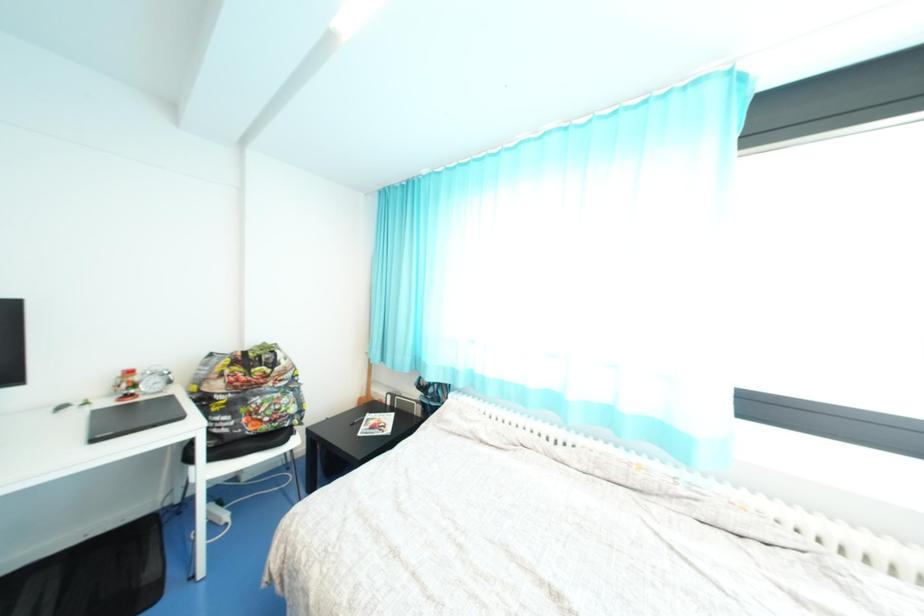
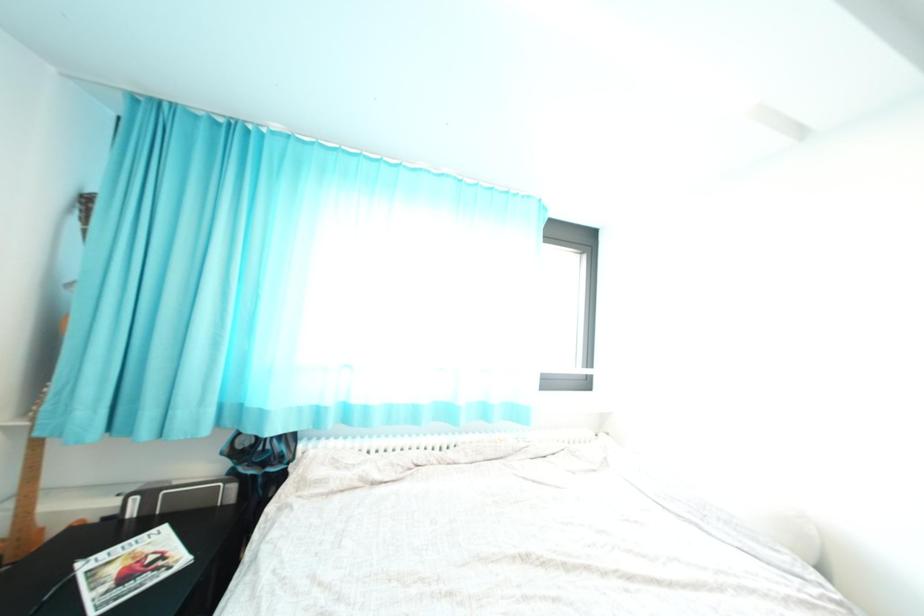
Question: The camera is either moving clockwise (left) or counter-clockwise (right) around the object. The first image is from the beginning of the video and the second image is from the end. Is the camera moving left or right when shooting the video?

Choices:
 (A) Left
 (B) Right

Answer: (A)